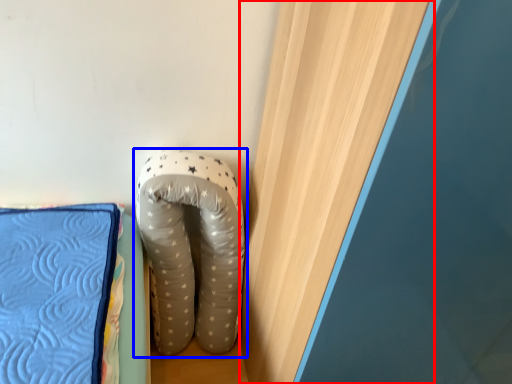
Question: Which of the following is the closest to the observer, curtain (highlighted by a red box) or footwear (highlighted by a blue box)?

Choices:
 (A) curtain
 (B) footwear

Answer: (A)